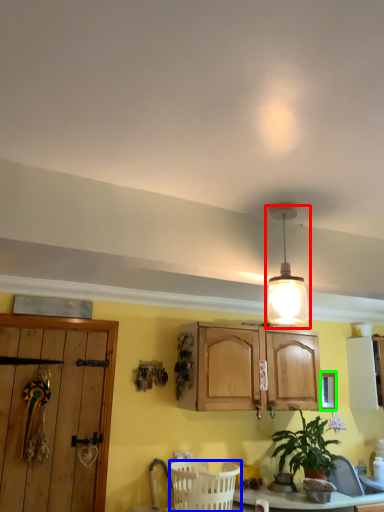
Question: Estimate the real-world distances between objects in this image. Which object is farther from lamp (highlighted by a red box), basket (highlighted by a blue box) or window (highlighted by a green box)?

Choices:
 (A) basket
 (B) window

Answer: (B)